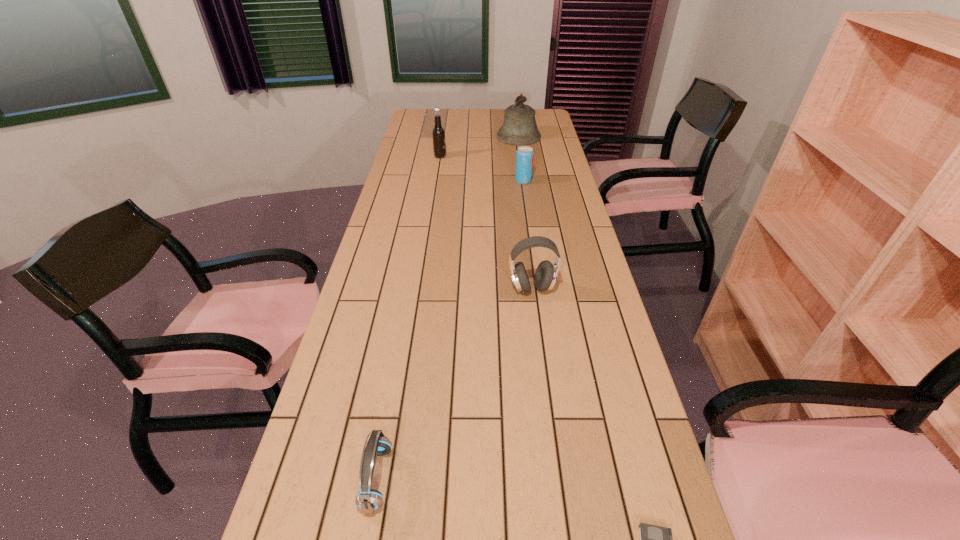
The width and height of the screenshot is (960, 540). Find the location of `the fifth nearest object`. the fifth nearest object is located at coordinates (438, 133).

The height and width of the screenshot is (540, 960). Identify the location of bell. (519, 129).

Identify the location of the taller headset. The image size is (960, 540). (546, 273).

Find the location of a particular element. This screenshot has width=960, height=540. the right headset is located at coordinates (546, 273).

Where is `soda can`? This screenshot has height=540, width=960. soda can is located at coordinates (524, 158).

The image size is (960, 540). Find the location of `the third farthest object`. the third farthest object is located at coordinates (524, 158).

At what (x,y) coordinates should I click in order to perform the action: click on the nearer headset. Please return your answer as a coordinate pair (x, y). The width and height of the screenshot is (960, 540). Looking at the image, I should click on (369, 500).

In order to click on the left headset in this screenshot , I will do `click(369, 500)`.

The width and height of the screenshot is (960, 540). In order to click on free space located 0.350m on the label of the root beer in this screenshot , I will do `click(525, 157)`.

In order to click on vacant space located on the front of the farthest object in this screenshot , I will do `click(526, 185)`.